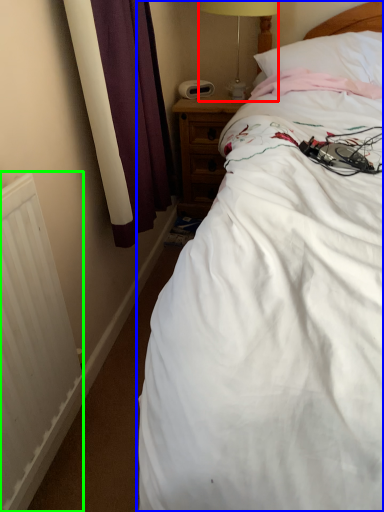
Question: Estimate the real-world distances between objects in this image. Which object is closer to table lamp (highlighted by a red box), bed (highlighted by a blue box) or radiator (highlighted by a green box)?

Choices:
 (A) bed
 (B) radiator

Answer: (A)